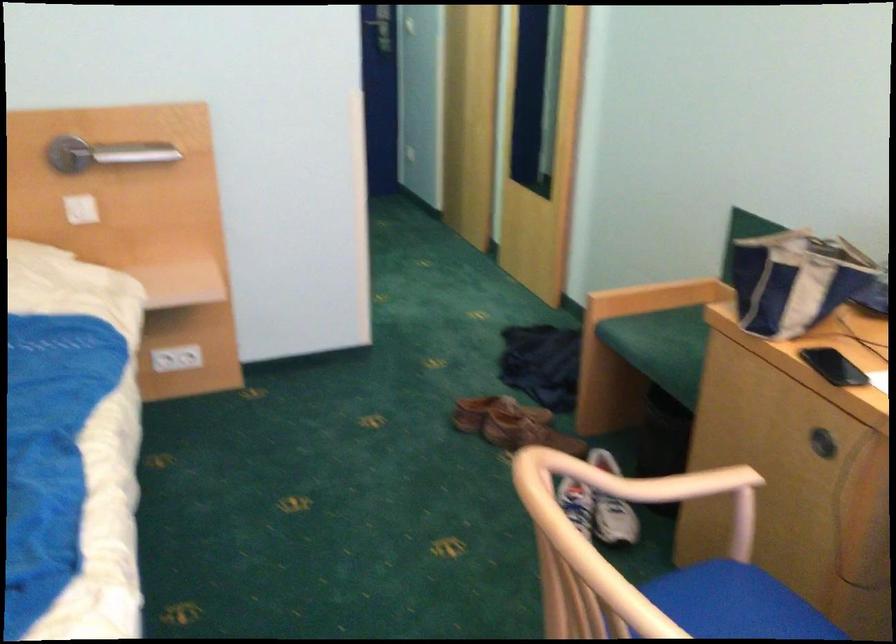
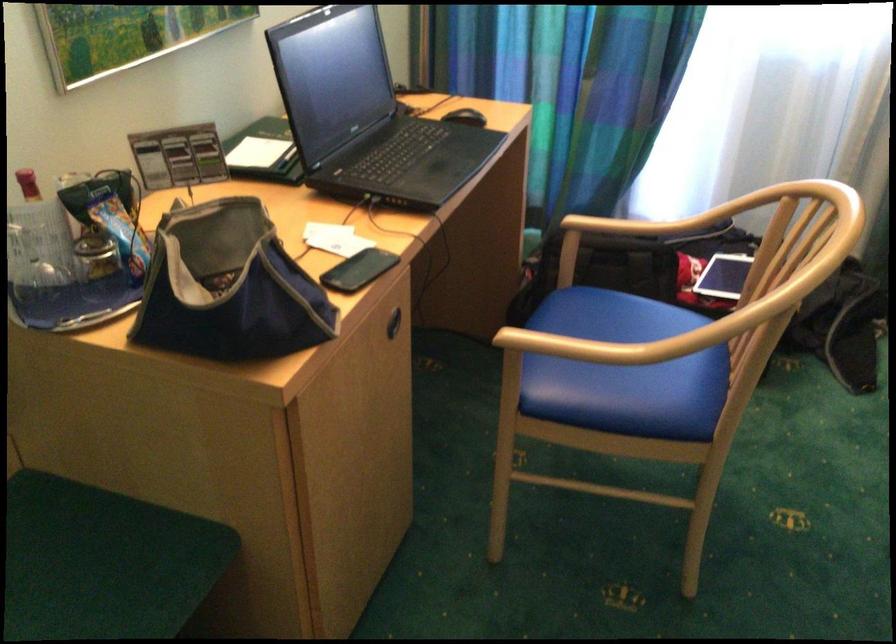
Locate, in the second image, the point that corresponds to (x=768, y=252) in the first image.

(228, 287)